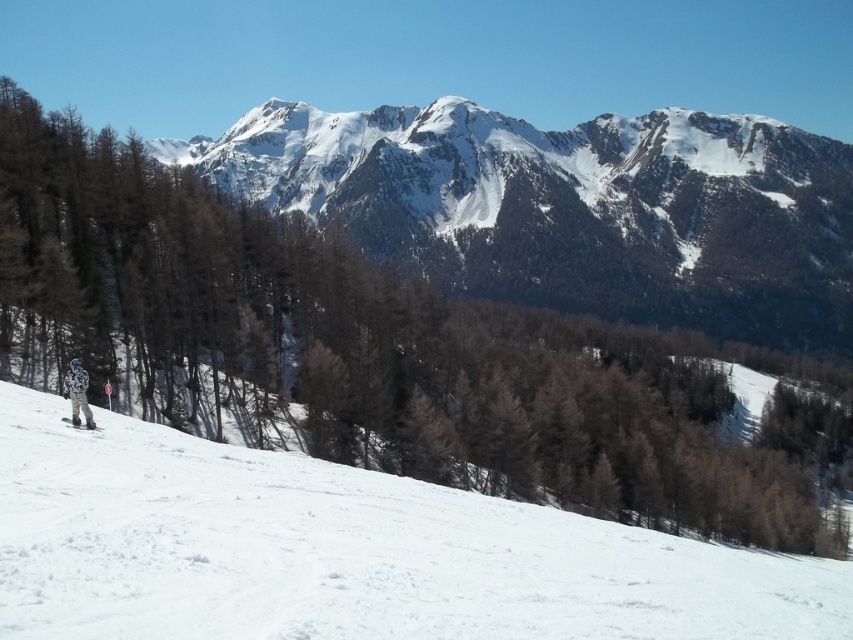
Question: Among these objects, which one is farthest from the camera?

Choices:
 (A) white matte ski at lower left
 (B) snowy granite mountain at upper center
 (C) white snowboarder at lower left

Answer: (B)

Question: Can you confirm if white snow at lower left is thinner than white snowboarder at lower left?

Choices:
 (A) yes
 (B) no

Answer: (B)

Question: Does white snow at lower left have a larger size compared to white snowboarder at lower left?

Choices:
 (A) no
 (B) yes

Answer: (B)

Question: Which point is closer to the camera?

Choices:
 (A) (65, 417)
 (B) (299, 204)
 (C) (79, 381)
 (D) (3, 518)

Answer: (D)

Question: Considering the real-world distances, which object is farthest from the snowy granite mountain at upper center?

Choices:
 (A) white snow at lower left
 (B) white snowboarder at lower left

Answer: (B)

Question: Does white snow at lower left have a greater width compared to white snowboarder at lower left?

Choices:
 (A) no
 (B) yes

Answer: (B)